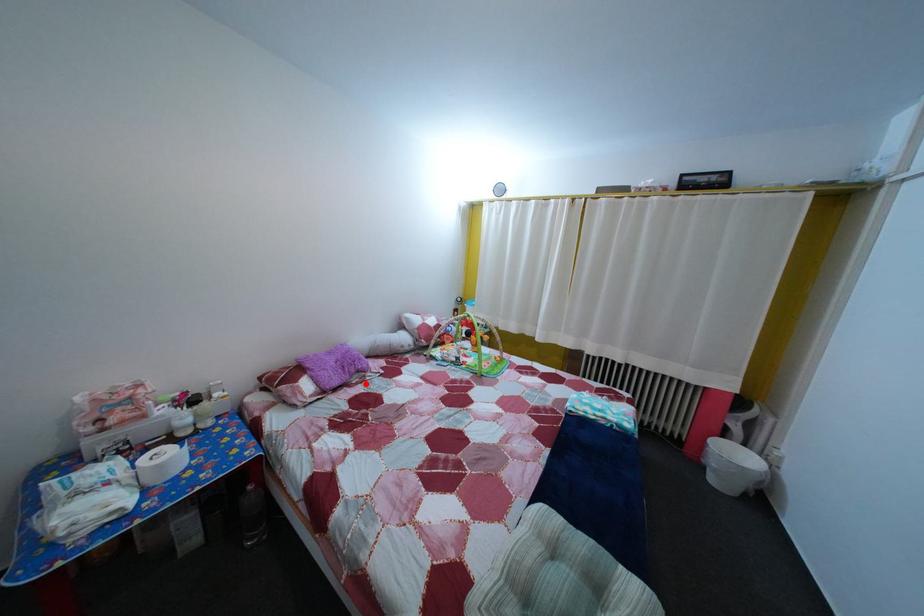
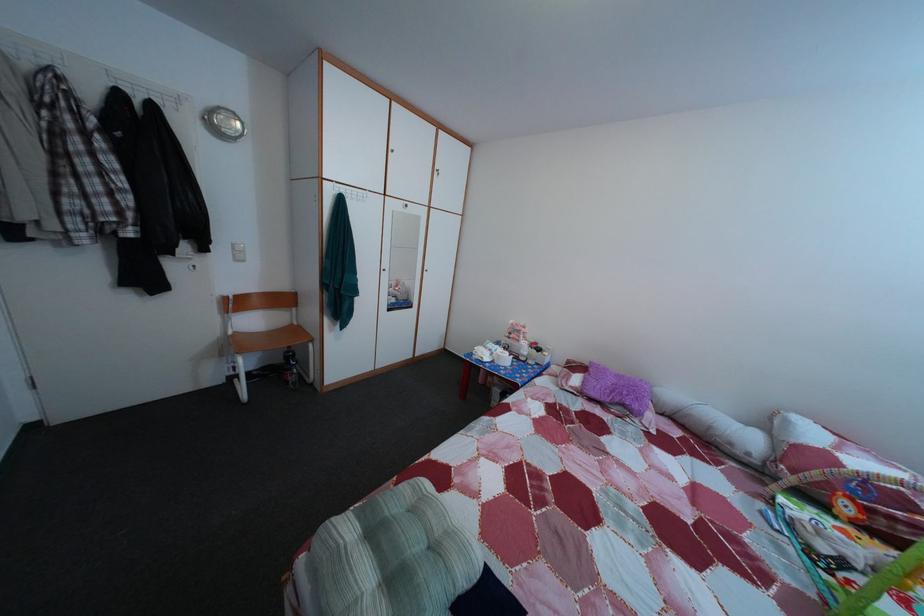
Where in the second image is the point corresponding to the highlighted location from the first image?

(628, 416)